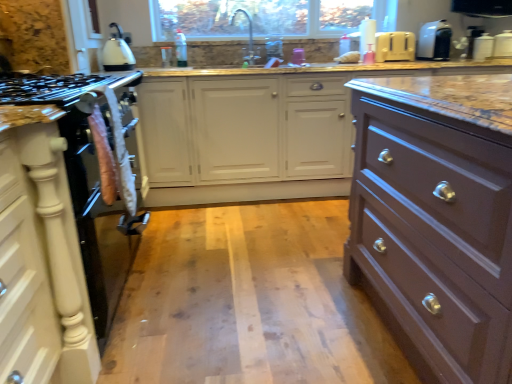
Question: From a real-world perspective, is satin nickel faucet at upper center under white plastic toaster at upper right, which is counted as the first appliance, starting from the left?

Choices:
 (A) yes
 (B) no

Answer: (B)

Question: From the image's perspective, would you say satin nickel faucet at upper center is positioned over white plastic toaster at upper right, which is counted as the first appliance, starting from the left?

Choices:
 (A) yes
 (B) no

Answer: (A)

Question: Considering the relative positions of satin nickel faucet at upper center and white plastic toaster at upper right, which is counted as the first appliance, starting from the left, in the image provided, is satin nickel faucet at upper center to the left of white plastic toaster at upper right, which is counted as the first appliance, starting from the left, from the viewer's perspective?

Choices:
 (A) no
 (B) yes

Answer: (B)

Question: Is satin nickel faucet at upper center closer to the viewer compared to white plastic toaster at upper right, the 4th appliance positioned from the right?

Choices:
 (A) yes
 (B) no

Answer: (A)

Question: Is white plastic toaster at upper right, which is counted as the first appliance, starting from the left, a part of satin nickel faucet at upper center?

Choices:
 (A) yes
 (B) no

Answer: (B)

Question: From a real-world perspective, does satin nickel faucet at upper center stand above white plastic toaster at upper right, the 4th appliance positioned from the right?

Choices:
 (A) yes
 (B) no

Answer: (A)

Question: Is white plastic toaster at upper right, the second appliance viewed from the left, wider than satin brown drawer at right?

Choices:
 (A) no
 (B) yes

Answer: (A)

Question: Is white plastic toaster at upper right, the third appliance viewed from the right, far away from satin brown drawer at right?

Choices:
 (A) no
 (B) yes

Answer: (B)

Question: From a real-world perspective, is white plastic toaster at upper right, the third appliance viewed from the right, on top of satin brown drawer at right?

Choices:
 (A) no
 (B) yes

Answer: (B)

Question: Does white plastic toaster at upper right, the third appliance viewed from the right, have a smaller size compared to satin brown drawer at right?

Choices:
 (A) no
 (B) yes

Answer: (B)

Question: Does white plastic toaster at upper right, the third appliance viewed from the right, have a lesser height compared to satin brown drawer at right?

Choices:
 (A) no
 (B) yes

Answer: (B)

Question: Can we say white plastic toaster at upper right, the second appliance viewed from the left, lies outside satin brown drawer at right?

Choices:
 (A) yes
 (B) no

Answer: (A)

Question: Is white matte cabinet at left outside of marble countertop at center?

Choices:
 (A) yes
 (B) no

Answer: (A)